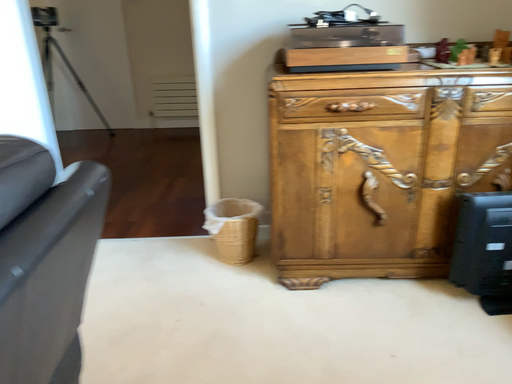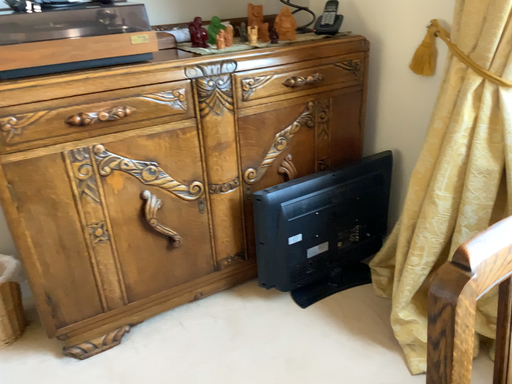
Question: Which way did the camera rotate in the video?

Choices:
 (A) rotated left
 (B) rotated right

Answer: (B)